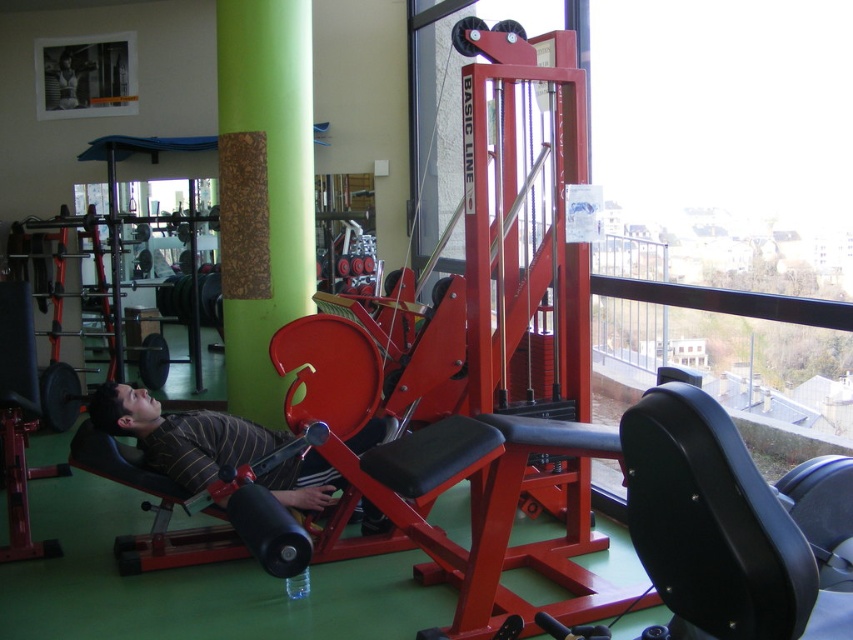
Question: Is cork-textured board at center wider than striped fabric shirt at center?

Choices:
 (A) yes
 (B) no

Answer: (B)

Question: Where is cork-textured board at center located in relation to striped fabric shirt at center in the image?

Choices:
 (A) right
 (B) left

Answer: (B)

Question: From the image, what is the correct spatial relationship of cork-textured board at center in relation to striped fabric shirt at center?

Choices:
 (A) below
 (B) above

Answer: (B)

Question: Among these objects, which one is farthest from the camera?

Choices:
 (A) cork-textured board at center
 (B) striped fabric shirt at center

Answer: (A)

Question: Which point is closer to the camera taking this photo?

Choices:
 (A) (234, 365)
 (B) (221, 458)

Answer: (B)